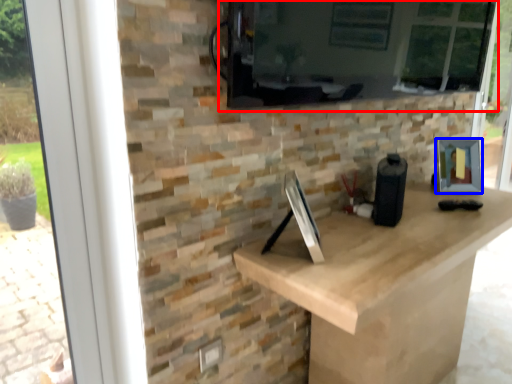
Question: Which point is further to the camera, window screen (highlighted by a red box) or picture frame (highlighted by a blue box)?

Choices:
 (A) window screen
 (B) picture frame

Answer: (B)